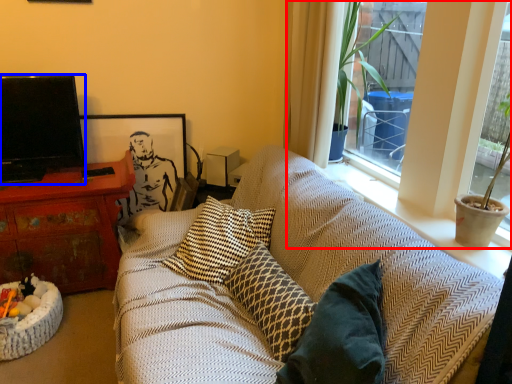
Question: Which of the following is the closest to the observer, bay window (highlighted by a red box) or television (highlighted by a blue box)?

Choices:
 (A) bay window
 (B) television

Answer: (A)